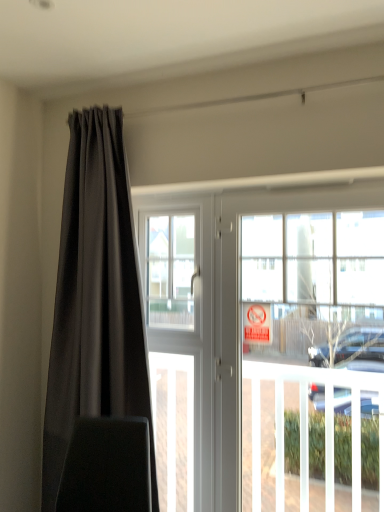
Question: Looking at the image, does velvet black swivel chair at left seem bigger or smaller compared to white glossy door at center?

Choices:
 (A) big
 (B) small

Answer: (B)

Question: Is velvet black swivel chair at left taller or shorter than white glossy door at center?

Choices:
 (A) tall
 (B) short

Answer: (B)

Question: Which object is positioned farthest from the red plastic sign at window?

Choices:
 (A) white glossy door at center
 (B) velvet black swivel chair at left
 (C) transparent glass window screen at center
 (D) matte black curtain at left

Answer: (B)

Question: Which is farther from the red plastic sign at window?

Choices:
 (A) transparent glass window screen at center
 (B) matte black curtain at left
 (C) velvet black swivel chair at left
 (D) white glossy door at center

Answer: (C)